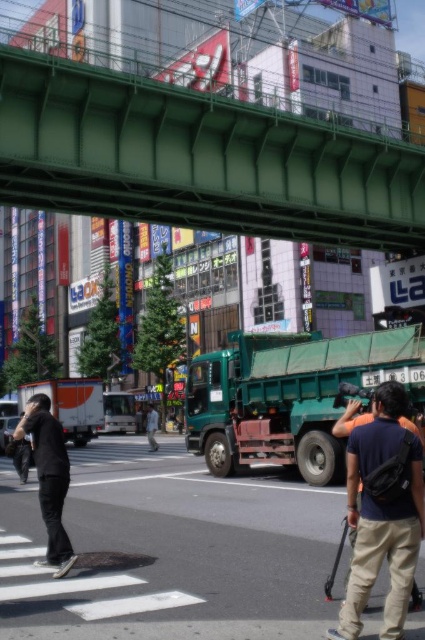
Question: Does metallic truck at center have a greater width compared to dark blue shirt at right?

Choices:
 (A) no
 (B) yes

Answer: (B)

Question: Which of these objects is positioned closest to the black matte shirt at left?

Choices:
 (A) dark blue shirt at right
 (B) green metallic bridge at upper center
 (C) light blue jeans at center

Answer: (A)

Question: Among these objects, which one is nearest to the camera?

Choices:
 (A) metallic truck at center
 (B) light blue jeans at center
 (C) dark blue shirt at right

Answer: (C)

Question: Is metallic truck at center above green metallic bridge at upper center?

Choices:
 (A) no
 (B) yes

Answer: (A)

Question: Which is farther from the dark blue shirt at right?

Choices:
 (A) metallic truck at center
 (B) black matte shirt at left

Answer: (B)

Question: Does black matte shirt at left have a larger size compared to light blue jeans at center?

Choices:
 (A) yes
 (B) no

Answer: (B)